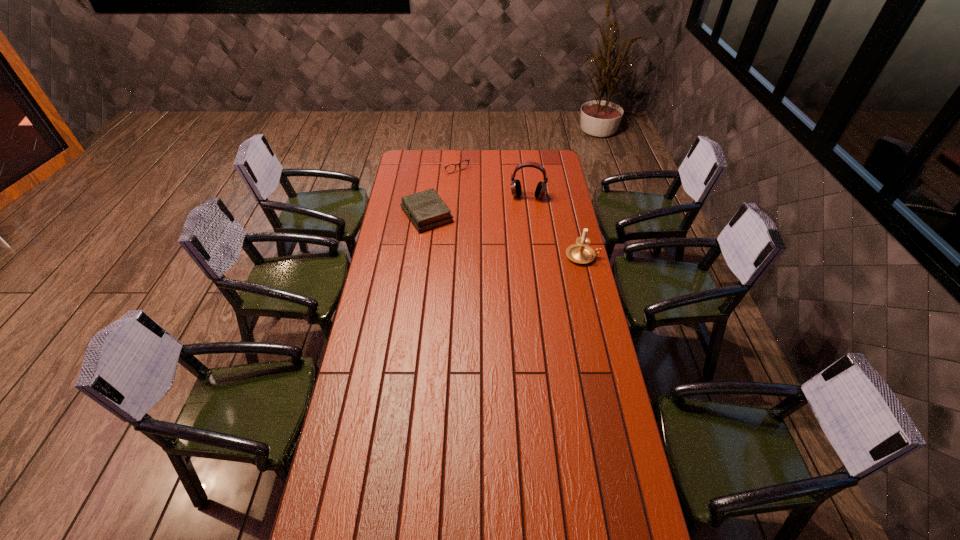
The image size is (960, 540). I want to click on free point located 0.330m on the ear pads of the tallest object, so click(520, 245).

At what (x,y) coordinates should I click in order to perform the action: click on vacant position located through the lenses of the spectacles. Please return your answer as a coordinate pair (x, y). The image size is (960, 540). Looking at the image, I should click on 468,183.

Locate an element on the screen. The image size is (960, 540). vacant space located 0.360m through the lenses of the spectacles is located at coordinates (492, 207).

Identify the location of free region located through the lenses of the spectacles. (476, 191).

You are a GUI agent. You are given a task and a screenshot of the screen. Output one action in this format:
    pyautogui.click(x=<x>, y=<y>)
    Task: Click on the object that is positioned at the far edge
    
    Given the screenshot: What is the action you would take?
    pyautogui.click(x=462, y=165)

This screenshot has width=960, height=540. What are the coordinates of `object that is at the left edge` in the screenshot? It's located at (426, 210).

At what (x,y) coordinates should I click in order to perform the action: click on candle holder situated at the right edge. Please return your answer as a coordinate pair (x, y). The height and width of the screenshot is (540, 960). Looking at the image, I should click on (581, 253).

Where is `headset positioned at the right edge`? headset positioned at the right edge is located at coordinates (516, 190).

The image size is (960, 540). In the image, there is a desktop. Find the location of `vacant area at the far edge`. vacant area at the far edge is located at coordinates (480, 156).

At what (x,y) coordinates should I click in order to perform the action: click on free space at the near edge. Please return your answer as a coordinate pair (x, y). The height and width of the screenshot is (540, 960). Looking at the image, I should click on (417, 519).